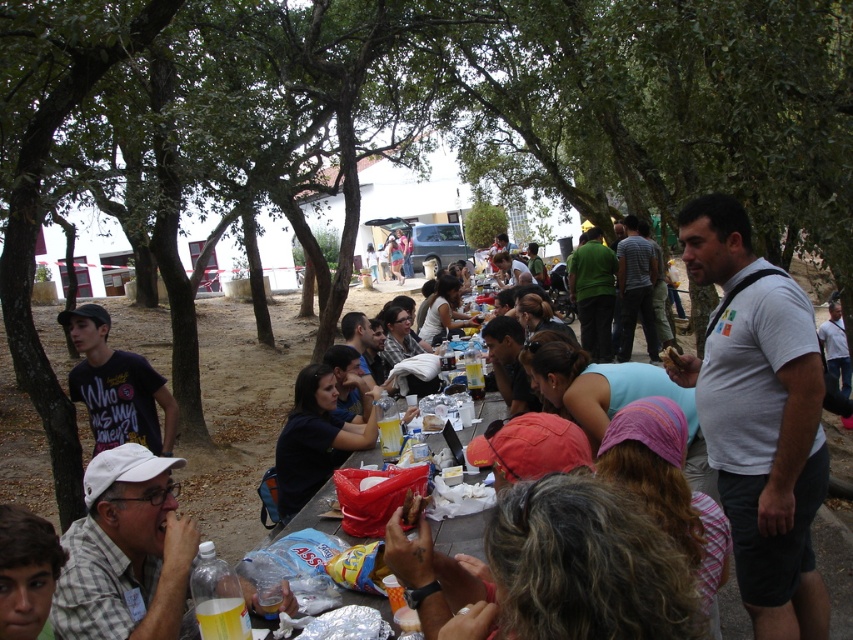
Does white cotton shirt at right come in front of light brown hair at lower left?

That is False.

Is white cotton shirt at right bigger than light brown hair at lower left?

Correct, white cotton shirt at right is larger in size than light brown hair at lower left.

I want to click on white cotton shirt at right, so click(759, 417).

The height and width of the screenshot is (640, 853). I want to click on white cotton shirt at right, so click(x=759, y=417).

Is matte black t-shirt at left shorter than light brown hair at lower left?

No.

Who is positioned more to the right, matte black t-shirt at left or light brown hair at lower left?

From the viewer's perspective, light brown hair at lower left appears more on the right side.

Is point (165, 435) closer to viewer compared to point (44, 582)?

No, it is behind (44, 582).

Identify the location of matte black t-shirt at left. Image resolution: width=853 pixels, height=640 pixels. (115, 387).

Which is above, gray checkered shirt at lower left or matte black shirt at center?

gray checkered shirt at lower left is higher up.

Is gray checkered shirt at lower left positioned before matte black shirt at center?

Yes.

The image size is (853, 640). Find the location of `gray checkered shirt at lower left`. gray checkered shirt at lower left is located at coordinates (125, 552).

Where is `gray checkered shirt at lower left`? The image size is (853, 640). gray checkered shirt at lower left is located at coordinates (125, 552).